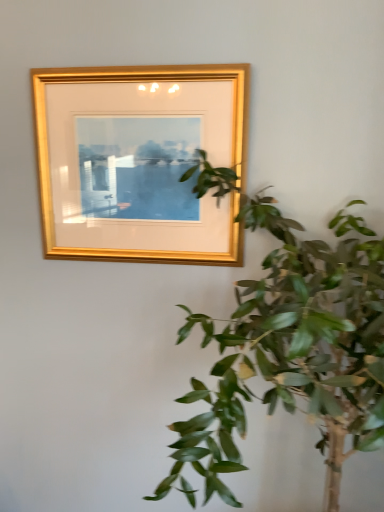
Question: Does green leafy plant at upper right have a lesser height compared to gold wood picture frame at upper center?

Choices:
 (A) no
 (B) yes

Answer: (A)

Question: Does green leafy plant at upper right lie behind gold wood picture frame at upper center?

Choices:
 (A) yes
 (B) no

Answer: (B)

Question: Considering the relative sizes of green leafy plant at upper right and gold wood picture frame at upper center in the image provided, is green leafy plant at upper right taller than gold wood picture frame at upper center?

Choices:
 (A) yes
 (B) no

Answer: (A)

Question: Can you confirm if green leafy plant at upper right is positioned to the right of gold wood picture frame at upper center?

Choices:
 (A) no
 (B) yes

Answer: (B)

Question: Is green leafy plant at upper right positioned beyond the bounds of gold wood picture frame at upper center?

Choices:
 (A) no
 (B) yes

Answer: (B)

Question: Can you confirm if green leafy plant at upper right is positioned to the left of gold wood picture frame at upper center?

Choices:
 (A) no
 (B) yes

Answer: (A)

Question: From the image's perspective, would you say gold wood picture frame at upper center is shown under green leafy plant at upper right?

Choices:
 (A) yes
 (B) no

Answer: (B)

Question: Is gold wood picture frame at upper center at the left side of green leafy plant at upper right?

Choices:
 (A) yes
 (B) no

Answer: (A)

Question: Considering the relative positions of gold wood picture frame at upper center and green leafy plant at upper right in the image provided, is gold wood picture frame at upper center to the right of green leafy plant at upper right from the viewer's perspective?

Choices:
 (A) no
 (B) yes

Answer: (A)

Question: From the image's perspective, is gold wood picture frame at upper center over green leafy plant at upper right?

Choices:
 (A) yes
 (B) no

Answer: (A)

Question: Could you tell me if gold wood picture frame at upper center is turned towards green leafy plant at upper right?

Choices:
 (A) yes
 (B) no

Answer: (B)

Question: Does gold wood picture frame at upper center have a greater width compared to green leafy plant at upper right?

Choices:
 (A) no
 (B) yes

Answer: (A)

Question: Considering the positions of point (375, 370) and point (125, 197), is point (375, 370) closer or farther from the camera than point (125, 197)?

Choices:
 (A) farther
 (B) closer

Answer: (B)